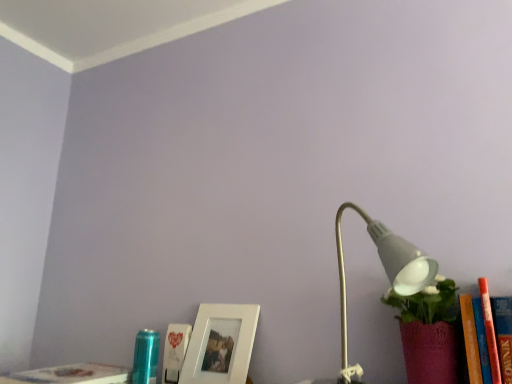
Question: Considering the relative sizes of white paper at lower center, acting as the second book starting from the left, and white matte picture frame at lower center in the image provided, is white paper at lower center, acting as the second book starting from the left, thinner than white matte picture frame at lower center?

Choices:
 (A) no
 (B) yes

Answer: (A)

Question: Does white paper at lower center, which ranks as the first book in right-to-left order, have a smaller size compared to white matte picture frame at lower center?

Choices:
 (A) yes
 (B) no

Answer: (A)

Question: Considering the relative sizes of white paper at lower center, acting as the second book starting from the left, and white matte picture frame at lower center in the image provided, is white paper at lower center, acting as the second book starting from the left, shorter than white matte picture frame at lower center?

Choices:
 (A) yes
 (B) no

Answer: (A)

Question: Can you confirm if white paper at lower center, acting as the second book starting from the left, is positioned to the left of white matte picture frame at lower center?

Choices:
 (A) no
 (B) yes

Answer: (B)

Question: Considering the relative positions of white paper at lower center, acting as the second book starting from the left, and white matte picture frame at lower center in the image provided, is white paper at lower center, acting as the second book starting from the left, to the right of white matte picture frame at lower center from the viewer's perspective?

Choices:
 (A) no
 (B) yes

Answer: (A)

Question: Considering the positions of point (416, 289) and point (175, 337), is point (416, 289) closer or farther from the camera than point (175, 337)?

Choices:
 (A) farther
 (B) closer

Answer: (B)

Question: From the image's perspective, is white matte lamp at right above or below white paper at lower center, which ranks as the first book in right-to-left order?

Choices:
 (A) above
 (B) below

Answer: (A)

Question: From a real-world perspective, relative to white paper at lower center, which ranks as the first book in right-to-left order, is white matte lamp at right vertically above or below?

Choices:
 (A) below
 (B) above

Answer: (B)

Question: Would you say white matte lamp at right is to the left or to the right of white paper at lower center, which ranks as the first book in right-to-left order, in the picture?

Choices:
 (A) right
 (B) left

Answer: (A)

Question: Choose the correct answer: Is white paper at lower center, which ranks as the first book in right-to-left order, inside white matte picture frame at lower center or outside it?

Choices:
 (A) inside
 (B) outside

Answer: (A)

Question: Is point (179, 339) positioned closer to the camera than point (187, 365)?

Choices:
 (A) closer
 (B) farther

Answer: (B)

Question: Looking at their shapes, would you say white paper at lower center, acting as the second book starting from the left, is wider or thinner than white matte picture frame at lower center?

Choices:
 (A) thin
 (B) wide

Answer: (B)

Question: Considering their positions, is white paper at lower center, which ranks as the first book in right-to-left order, located in front of or behind white matte picture frame at lower center?

Choices:
 (A) behind
 (B) front

Answer: (A)

Question: In the image, is white matte picture frame at lower center positioned in front of or behind white matte lamp at right?

Choices:
 (A) behind
 (B) front

Answer: (A)

Question: In terms of width, does white matte picture frame at lower center look wider or thinner when compared to white matte lamp at right?

Choices:
 (A) wide
 (B) thin

Answer: (B)